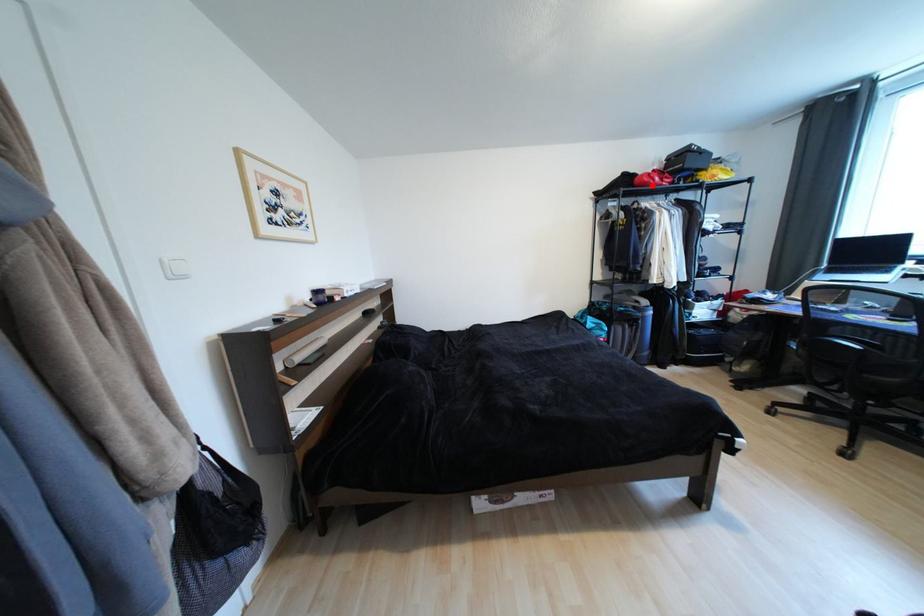
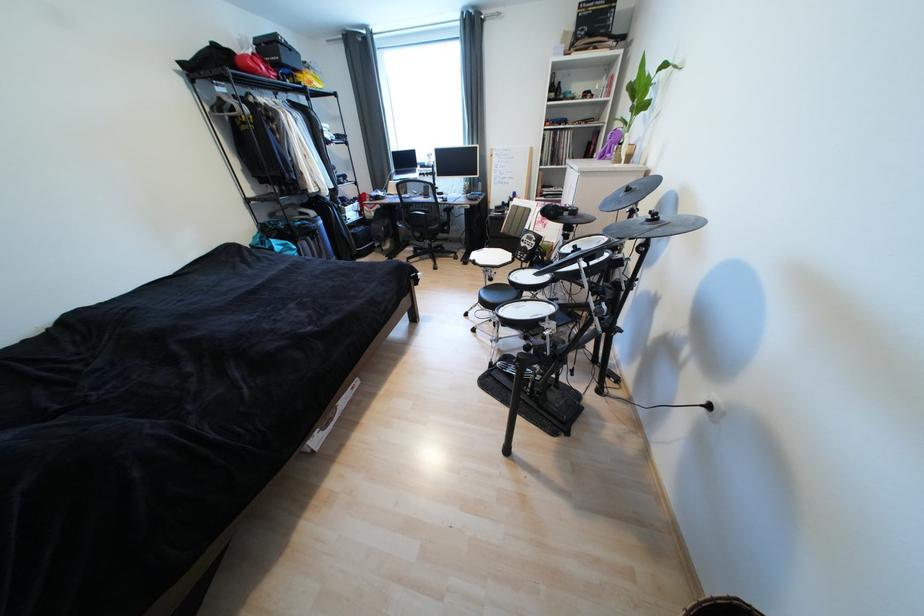
In the second image, find the point that corresponds to the highlighted location in the first image.

(261, 73)